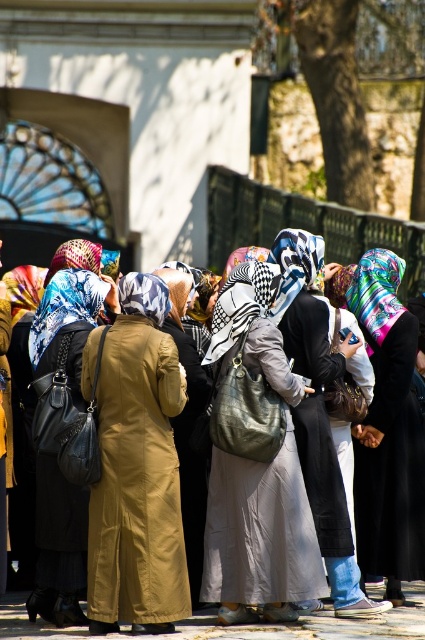
Question: Can you confirm if matte black bag at center is positioned below printed silk headscarf at center?

Choices:
 (A) yes
 (B) no

Answer: (A)

Question: Which point appears closest to the camera in this image?

Choices:
 (A) coord(263,387)
 (B) coord(122,483)
 (C) coord(30,356)

Answer: (B)

Question: Considering the real-world distances, which object is farthest from the printed silk headscarf at center?

Choices:
 (A) matte gray dress at center
 (B) matte brown coat at center
 (C) checkered fabric headscarf at center

Answer: (A)

Question: Which point is closer to the camera?

Choices:
 (A) (238, 618)
 (B) (322, 525)
 (C) (282, 292)

Answer: (A)

Question: From the image, what is the correct spatial relationship of matte gray dress at center in relation to matte black dress at center?

Choices:
 (A) left
 (B) right

Answer: (A)

Question: Does checkered fabric headscarf at center come behind printed silk headscarf at center?

Choices:
 (A) yes
 (B) no

Answer: (B)